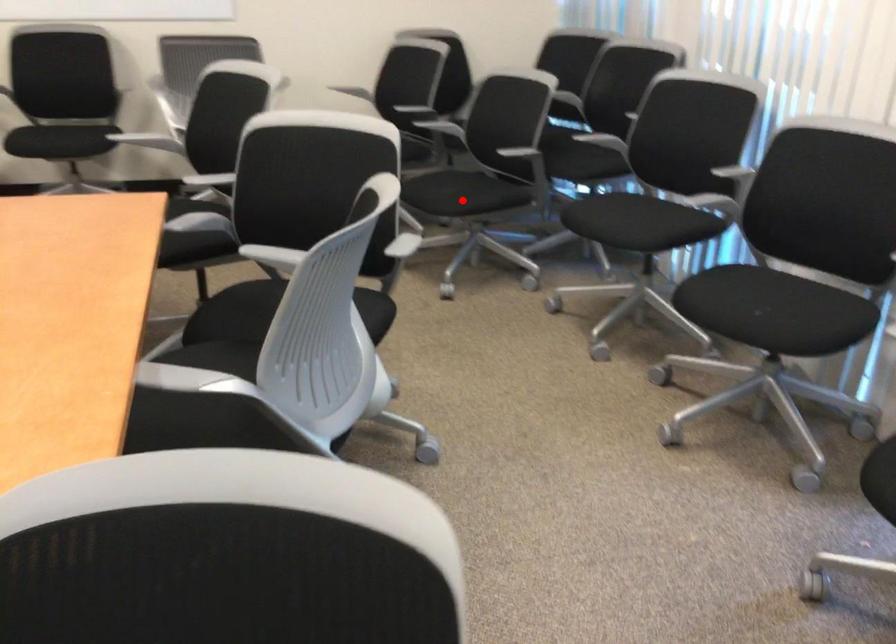
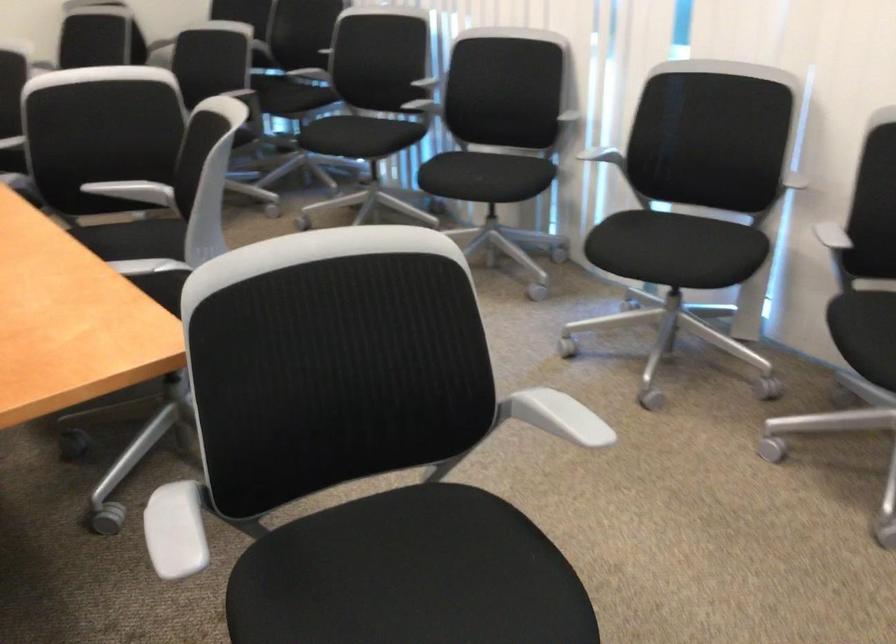
Question: I am providing you with two images of the same scene from different viewpoints. A red point is marked on the first image. Can you still see the location of the red point in image 2?

Choices:
 (A) Yes
 (B) No

Answer: (B)